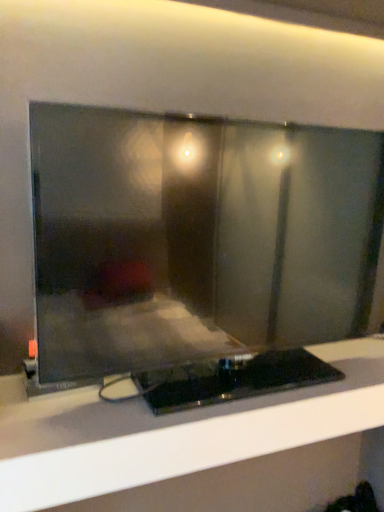
Where is `vacant area situated below matte black monitor at center (from a real-world perspective)`? Image resolution: width=384 pixels, height=512 pixels. vacant area situated below matte black monitor at center (from a real-world perspective) is located at coordinates [226, 388].